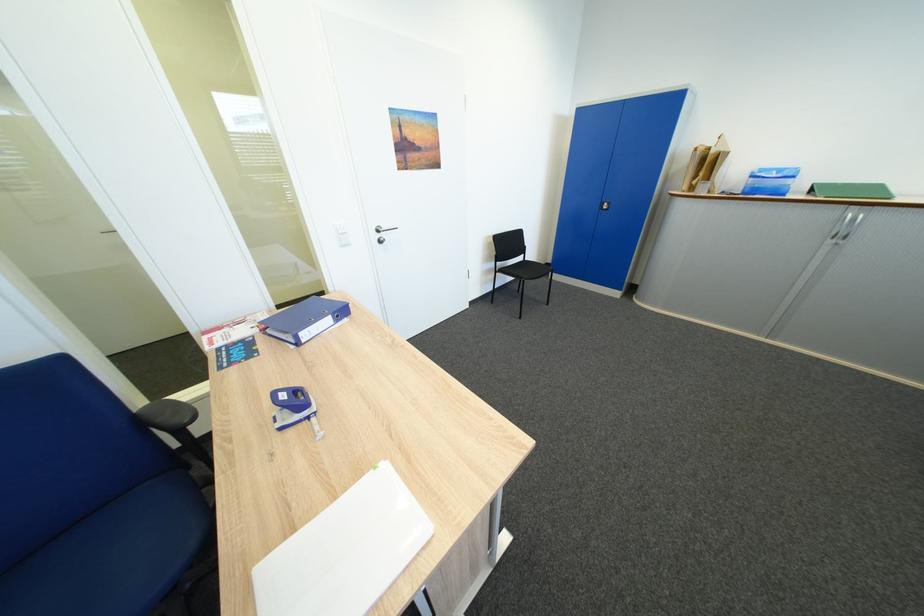
This screenshot has height=616, width=924. Find the location of `black chair armrest`. black chair armrest is located at coordinates (166, 415).